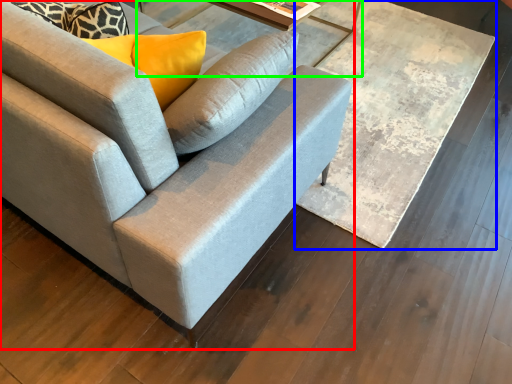
Question: Estimate the real-world distances between objects in this image. Which object is farther from studio couch (highlighted by a red box), table (highlighted by a blue box) or round table (highlighted by a green box)?

Choices:
 (A) table
 (B) round table

Answer: (B)